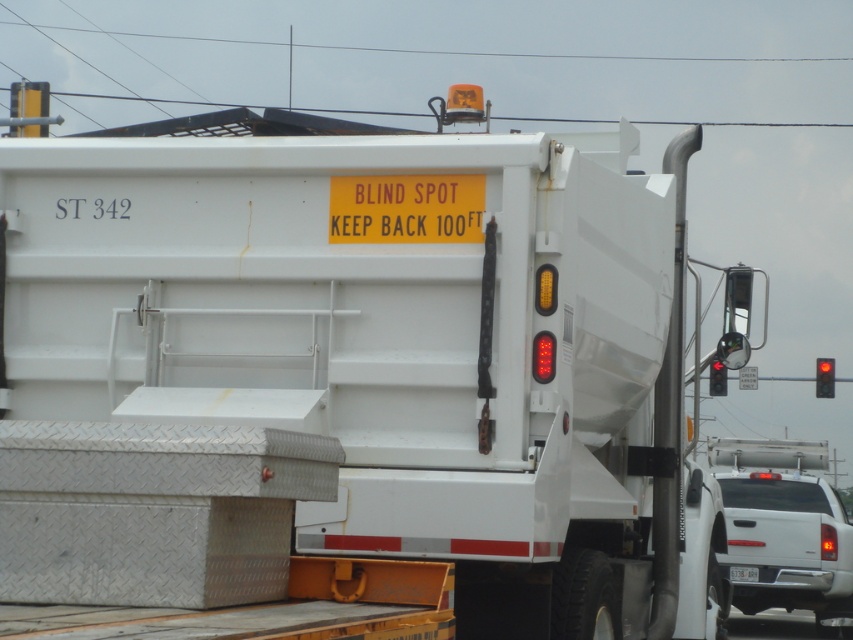
You are a delivery person approaching the back of the white dump truck. You notice the black wire at upper center and the white plastic license plate at center. Which object is positioned higher from the ground?

The black wire at upper center is above the white plastic license plate at center, so the black wire at upper center is positioned higher from the ground.

You are a delivery person needing to attach a GPS tracker to the highest point between the black wire at upper center and the white plastic license plate at center on the truck. Which object should you choose?

The black wire at upper center is much taller than the white plastic license plate at center, so you should attach the GPS tracker to the black wire at upper center as it is the higher point.

You are a delivery driver who just arrived at the construction site. You see a black wire at upper center and a white glossy truck at lower right. Which object is closer to you from your current position?

The black wire at upper center is closer to you because it is in front of the white glossy truck at lower right.